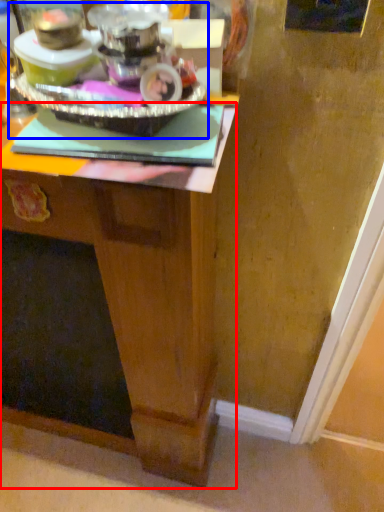
Question: Among these objects, which one is nearest to the camera, desk (highlighted by a red box) or appliance (highlighted by a blue box)?

Choices:
 (A) desk
 (B) appliance

Answer: (B)